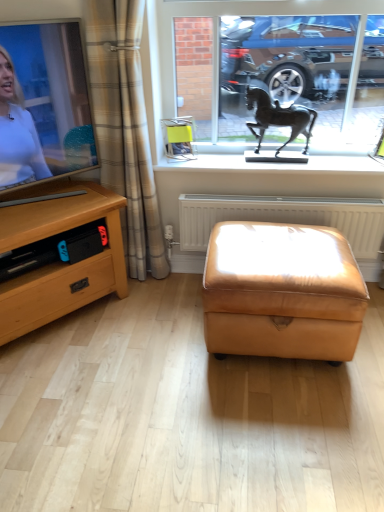
Find the location of a particular element. The width and height of the screenshot is (384, 512). empty space that is to the right of yellow fabric picture frame at center is located at coordinates (218, 157).